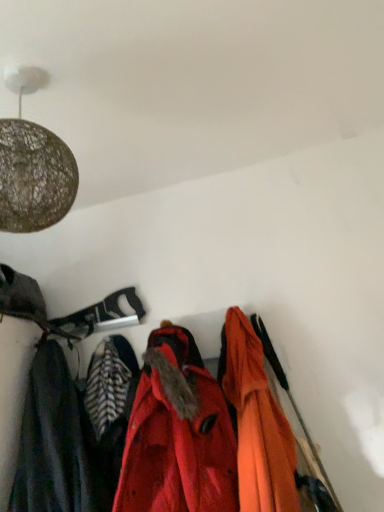
Where is `dark gray fabric at left`? The height and width of the screenshot is (512, 384). dark gray fabric at left is located at coordinates (21, 297).

The width and height of the screenshot is (384, 512). What do you see at coordinates (256, 422) in the screenshot? I see `orange matte jacket at center, the 1th jacket positioned from the right` at bounding box center [256, 422].

Where is `dark gray fabric at left`? dark gray fabric at left is located at coordinates (21, 297).

Is dark gray fabric at left touching red matte jacket at center, the 2th jacket positioned from the right?

No, dark gray fabric at left is not with red matte jacket at center, the 2th jacket positioned from the right.

Does dark gray fabric at left have a smaller size compared to red matte jacket at center, the 2th jacket positioned from the right?

Indeed, dark gray fabric at left has a smaller size compared to red matte jacket at center, the 2th jacket positioned from the right.

How many degrees apart are the facing directions of dark gray fabric at left and red matte jacket at center, the 2th jacket positioned from the right?

dark gray fabric at left and red matte jacket at center, the 2th jacket positioned from the right, are facing 4.09e-05 degrees away from each other.

Who is bigger, orange matte jacket at center, positioned as the second jacket in left-to-right order, or red matte jacket at center, the 2th jacket positioned from the right?

Bigger between the two is red matte jacket at center, the 2th jacket positioned from the right.

Image resolution: width=384 pixels, height=512 pixels. Identify the location of jacket behind the red matte jacket at center, the 2th jacket positioned from the right. (256, 422).

From the image's perspective, which is below, orange matte jacket at center, the 1th jacket positioned from the right, or red matte jacket at center, placed as the first jacket when sorted from left to right?

red matte jacket at center, placed as the first jacket when sorted from left to right, appears lower in the image.

Is red matte jacket at center, the 2th jacket positioned from the right, far away from dark gray fabric at left?

No, red matte jacket at center, the 2th jacket positioned from the right, is not far away from dark gray fabric at left.

Is the position of red matte jacket at center, placed as the first jacket when sorted from left to right, less distant than that of dark gray fabric at left?

Yes, the depth of red matte jacket at center, placed as the first jacket when sorted from left to right, is less than that of dark gray fabric at left.

How much distance is there between red matte jacket at center, placed as the first jacket when sorted from left to right, and dark gray fabric at left?

red matte jacket at center, placed as the first jacket when sorted from left to right, and dark gray fabric at left are 23.60 inches apart.

Which is nearer, (16, 314) or (269, 443)?

Point (16, 314) appears to be farther away from the viewer than point (269, 443).

Can you confirm if dark gray fabric at left is thinner than orange matte jacket at center, positioned as the second jacket in left-to-right order?

No.

Between dark gray fabric at left and orange matte jacket at center, positioned as the second jacket in left-to-right order, which one appears on the left side from the viewer's perspective?

dark gray fabric at left.

Is orange matte jacket at center, the 1th jacket positioned from the right, inside dark gray fabric at left?

Actually, orange matte jacket at center, the 1th jacket positioned from the right, is outside dark gray fabric at left.

From a real-world perspective, is orange matte jacket at center, positioned as the second jacket in left-to-right order, above or below dark gray fabric at left?

orange matte jacket at center, positioned as the second jacket in left-to-right order, is below dark gray fabric at left.

From the image's perspective, between orange matte jacket at center, positioned as the second jacket in left-to-right order, and dark gray fabric at left, which one is located above?

dark gray fabric at left, from the image's perspective.

Is point (294, 439) farther from viewer compared to point (34, 293)?

No, (294, 439) is closer to viewer.

Considering the sizes of objects orange matte jacket at center, positioned as the second jacket in left-to-right order, and dark gray fabric at left in the image provided, who is bigger, orange matte jacket at center, positioned as the second jacket in left-to-right order, or dark gray fabric at left?

orange matte jacket at center, positioned as the second jacket in left-to-right order.

Which object is closer to the camera, red matte jacket at center, placed as the first jacket when sorted from left to right, or orange matte jacket at center, positioned as the second jacket in left-to-right order?

red matte jacket at center, placed as the first jacket when sorted from left to right, is more forward.

Is point (199, 453) positioned in front of point (229, 398)?

That is True.

From a real-world perspective, which is physically below, red matte jacket at center, the 2th jacket positioned from the right, or orange matte jacket at center, the 1th jacket positioned from the right?

orange matte jacket at center, the 1th jacket positioned from the right, is physically lower.

Looking at this image, is red matte jacket at center, the 2th jacket positioned from the right, situated inside orange matte jacket at center, the 1th jacket positioned from the right, or outside?

red matte jacket at center, the 2th jacket positioned from the right, is outside orange matte jacket at center, the 1th jacket positioned from the right.

This screenshot has height=512, width=384. I want to click on cloak behind the red matte jacket at center, the 2th jacket positioned from the right, so click(21, 297).

Find the location of `jacket on the right of red matte jacket at center, the 2th jacket positioned from the right`. jacket on the right of red matte jacket at center, the 2th jacket positioned from the right is located at coordinates (256, 422).

Looking at the image, which one is located further to dark gray fabric at left, orange matte jacket at center, positioned as the second jacket in left-to-right order, or red matte jacket at center, placed as the first jacket when sorted from left to right?

orange matte jacket at center, positioned as the second jacket in left-to-right order.

From the image, which object appears to be farther from dark gray fabric at left, red matte jacket at center, the 2th jacket positioned from the right, or orange matte jacket at center, the 1th jacket positioned from the right?

Among the two, orange matte jacket at center, the 1th jacket positioned from the right, is located further to dark gray fabric at left.

Estimate the real-world distances between objects in this image. Which object is further from red matte jacket at center, placed as the first jacket when sorted from left to right, orange matte jacket at center, the 1th jacket positioned from the right, or dark gray fabric at left?

dark gray fabric at left.

Looking at the image, which one is located closer to red matte jacket at center, the 2th jacket positioned from the right, dark gray fabric at left or orange matte jacket at center, the 1th jacket positioned from the right?

orange matte jacket at center, the 1th jacket positioned from the right.

Looking at the image, which one is located closer to orange matte jacket at center, positioned as the second jacket in left-to-right order, dark gray fabric at left or red matte jacket at center, placed as the first jacket when sorted from left to right?

red matte jacket at center, placed as the first jacket when sorted from left to right, lies closer to orange matte jacket at center, positioned as the second jacket in left-to-right order, than the other object.

Considering their positions, is red matte jacket at center, placed as the first jacket when sorted from left to right, positioned closer to orange matte jacket at center, positioned as the second jacket in left-to-right order, than dark gray fabric at left?

Based on the image, red matte jacket at center, placed as the first jacket when sorted from left to right, appears to be nearer to orange matte jacket at center, positioned as the second jacket in left-to-right order.

This screenshot has height=512, width=384. In order to click on jacket located between dark gray fabric at left and orange matte jacket at center, positioned as the second jacket in left-to-right order, in the left-right direction in this screenshot , I will do `click(177, 434)`.